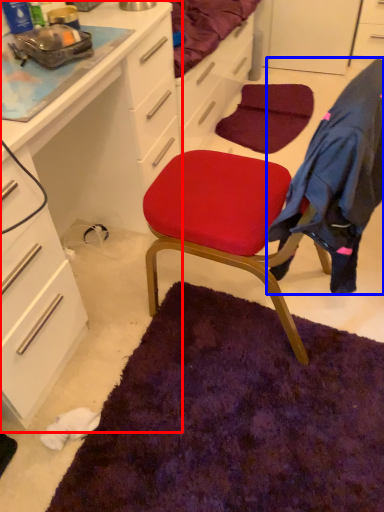
Question: Among these objects, which one is farthest to the camera, cabinetry (highlighted by a red box) or clothing (highlighted by a blue box)?

Choices:
 (A) cabinetry
 (B) clothing

Answer: (B)